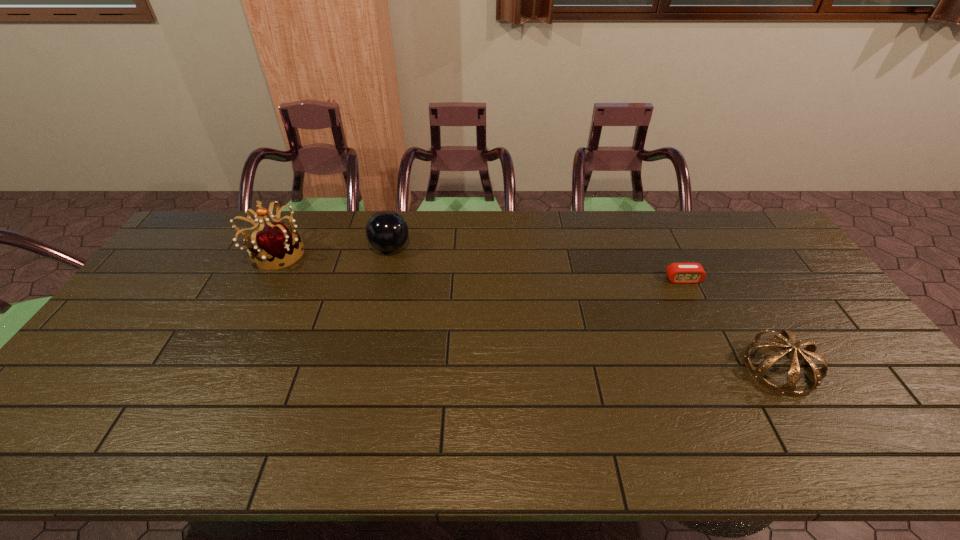
Locate an element on the screen. Image resolution: width=960 pixels, height=540 pixels. vacant region that satisfies the following two spatial constraints: 1. on the front-facing side of the nearest object; 2. on the right side of the alarm clock is located at coordinates (727, 369).

Find the location of a particular element. This screenshot has width=960, height=540. vacant region that satisfies the following two spatial constraints: 1. on the front-facing side of the shortest object; 2. on the right side of the nearest object is located at coordinates (727, 369).

You are a GUI agent. You are given a task and a screenshot of the screen. Output one action in this format:
    pyautogui.click(x=<x>, y=<y>)
    Task: Click on the blank space that satisfies the following two spatial constraints: 1. on the front-facing side of the nearest object; 2. on the right side of the shortest object
    
    Given the screenshot: What is the action you would take?
    pyautogui.click(x=727, y=369)

What are the coordinates of `free space that satisfies the following two spatial constraints: 1. on the front-facing side of the alarm clock; 2. on the left side of the nearest object` in the screenshot? It's located at (727, 369).

Find the location of a particular element. Image resolution: width=960 pixels, height=540 pixels. free point that satisfies the following two spatial constraints: 1. on the front-facing side of the leftmost object; 2. on the left side of the third tallest object is located at coordinates (214, 369).

Find the location of `vacant space that satisfies the following two spatial constraints: 1. on the back side of the nearest object; 2. on the front-facing side of the tallest object`. vacant space that satisfies the following two spatial constraints: 1. on the back side of the nearest object; 2. on the front-facing side of the tallest object is located at coordinates (710, 253).

Locate an element on the screen. blank area in the image that satisfies the following two spatial constraints: 1. on the front-facing side of the right tiara; 2. on the right side of the alarm clock is located at coordinates (727, 369).